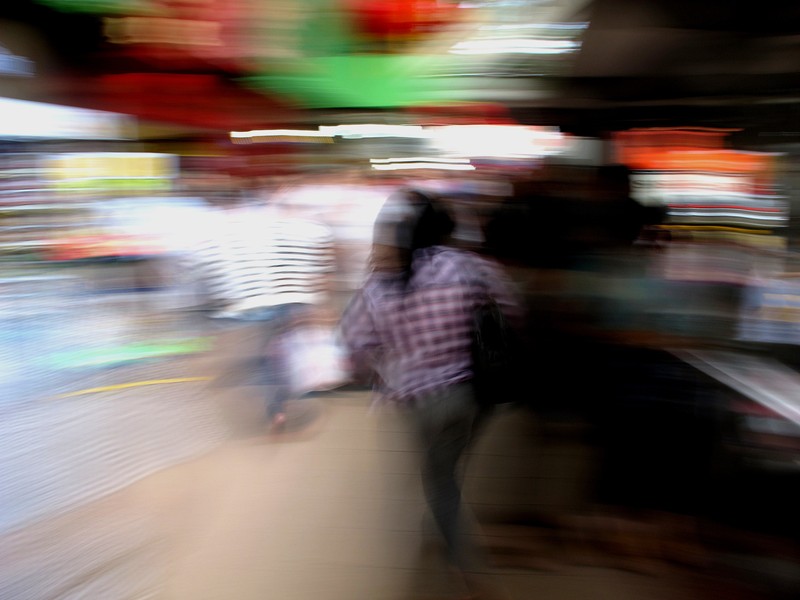
Where is `light`? Image resolution: width=800 pixels, height=600 pixels. light is located at coordinates (222, 257).